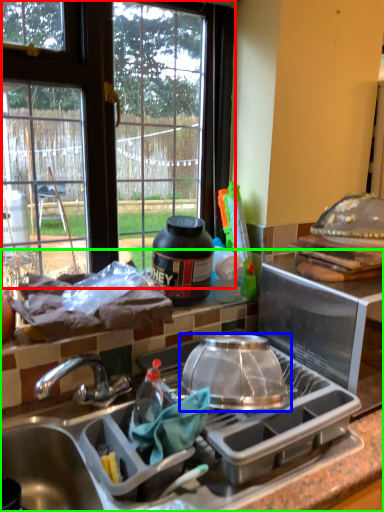
Question: Considering the real-world distances, which object is farthest from window (highlighted by a red box)? kitchen appliance (highlighted by a blue box) or countertop (highlighted by a green box)?

Choices:
 (A) kitchen appliance
 (B) countertop

Answer: (A)